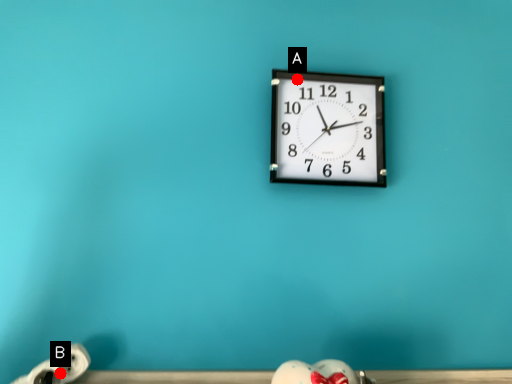
Question: Two points are circled on the image, labeled by A and B beside each circle. Which point appears closest to the camera in this image?

Choices:
 (A) A is closer
 (B) B is closer

Answer: (B)